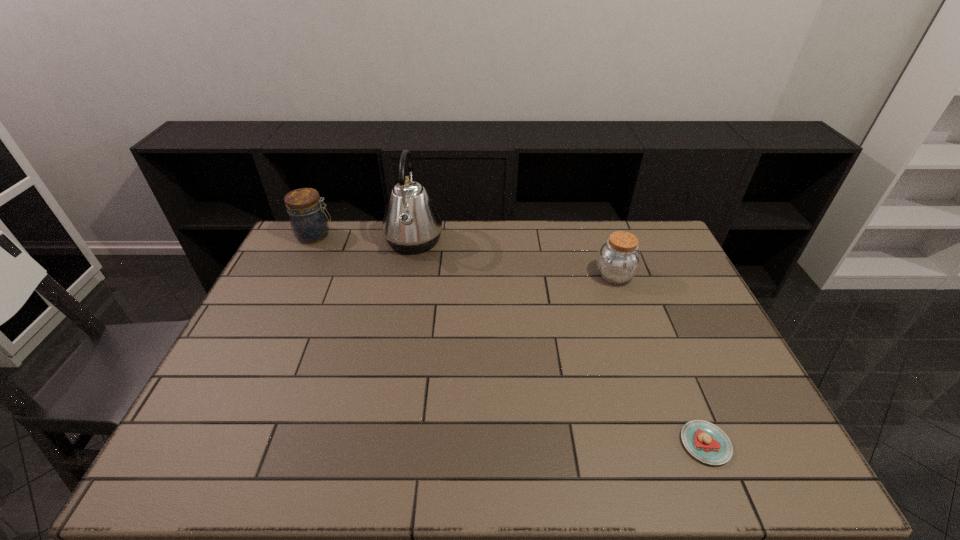
This screenshot has height=540, width=960. I want to click on vacant area situated on the left of the shorter jar, so click(518, 275).

This screenshot has height=540, width=960. I want to click on vacant position located 0.290m on the left of the nearest object, so click(556, 443).

What are the coordinates of `kettle that is positioned at the far edge` in the screenshot? It's located at (411, 224).

Locate an element on the screen. The height and width of the screenshot is (540, 960). jar that is at the far edge is located at coordinates (309, 223).

Find the location of `object positioned at the near edge`. object positioned at the near edge is located at coordinates (705, 441).

Identify the location of object that is positioned at the left edge. Image resolution: width=960 pixels, height=540 pixels. (309, 223).

Image resolution: width=960 pixels, height=540 pixels. What are the coordinates of `object that is at the right edge` in the screenshot? It's located at (705, 441).

Image resolution: width=960 pixels, height=540 pixels. I want to click on object that is at the far left corner, so click(309, 223).

You are a GUI agent. You are given a task and a screenshot of the screen. Output one action in this format:
    pyautogui.click(x=<x>, y=<y>)
    Task: Click on the object that is at the near right corner
    This screenshot has height=540, width=960.
    Given the screenshot: What is the action you would take?
    pyautogui.click(x=705, y=441)

This screenshot has height=540, width=960. Identify the location of blank area at the far edge. (362, 223).